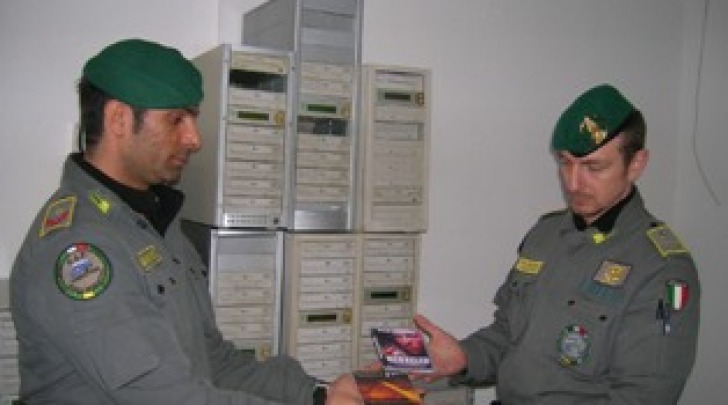
This screenshot has width=728, height=405. In order to click on hanging chord in this screenshot , I will do `click(700, 57)`.